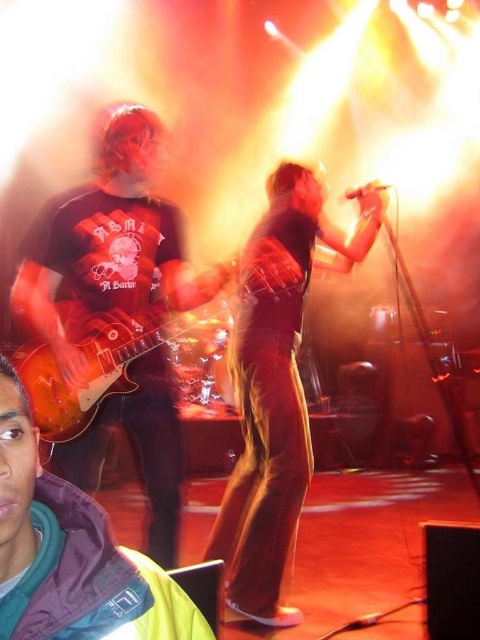
Question: Which point is closer to the camera?

Choices:
 (A) glossy wood guitar at left
 (B) shiny black microphone at center
 (C) shiny red guitar at left
 (D) matte black guitar at center

Answer: (C)

Question: From the image, what is the correct spatial relationship of shiny black microphone at center in relation to shiny red guitar at left?

Choices:
 (A) left
 (B) right

Answer: (B)

Question: Which object is farther from the camera taking this photo?

Choices:
 (A) glossy wood guitar at left
 (B) shiny black microphone at center
 (C) matte black guitar at center

Answer: (B)

Question: Can you confirm if matte black guitar at center is positioned to the left of shiny red guitar at left?

Choices:
 (A) yes
 (B) no

Answer: (B)

Question: Where is matte black guitar at center located in relation to shiny red guitar at left in the image?

Choices:
 (A) left
 (B) right

Answer: (B)

Question: Based on their relative distances, which object is nearer to the glossy wood guitar at left?

Choices:
 (A) matte black guitar at center
 (B) shiny black microphone at center

Answer: (A)